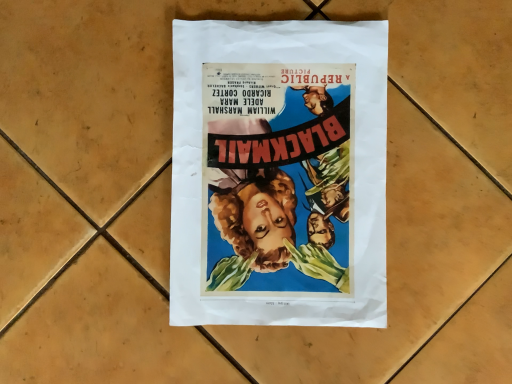
Locate an element on the screen. This screenshot has height=384, width=512. vacant space situated above matte paper poster at center (from a real-world perspective) is located at coordinates (282, 171).